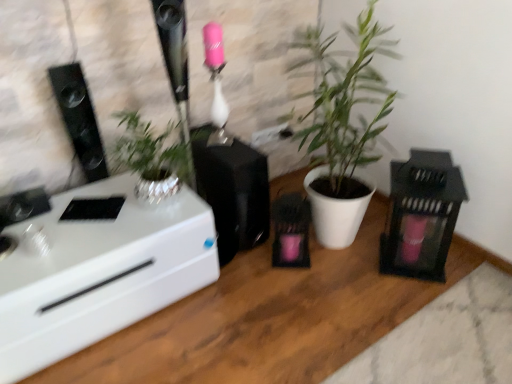
Question: Is black matte speaker at center, which is counted as the first appliance, starting from the left, placed right next to white glossy desk at left?

Choices:
 (A) no
 (B) yes

Answer: (A)

Question: Is black matte speaker at center, which is counted as the first appliance, starting from the left, not within white glossy desk at left?

Choices:
 (A) no
 (B) yes

Answer: (B)

Question: Is black matte speaker at center, arranged as the second appliance when viewed from the right, further to camera compared to white glossy desk at left?

Choices:
 (A) no
 (B) yes

Answer: (B)

Question: Is black matte speaker at center, arranged as the second appliance when viewed from the right, positioned in front of white glossy desk at left?

Choices:
 (A) yes
 (B) no

Answer: (B)

Question: Considering the relative sizes of black matte speaker at center, which is counted as the first appliance, starting from the left, and white glossy desk at left in the image provided, is black matte speaker at center, which is counted as the first appliance, starting from the left, smaller than white glossy desk at left?

Choices:
 (A) no
 (B) yes

Answer: (B)

Question: Does black matte speaker at center, arranged as the second appliance when viewed from the right, turn towards white glossy desk at left?

Choices:
 (A) no
 (B) yes

Answer: (A)

Question: From the image's perspective, would you say black glossy speaker at left is shown under black matte lantern at right, which is the 2th appliance from left to right?

Choices:
 (A) no
 (B) yes

Answer: (A)

Question: Is black glossy speaker at left positioned in front of black matte lantern at right, which is the 2th appliance from left to right?

Choices:
 (A) no
 (B) yes

Answer: (B)

Question: Is black glossy speaker at left positioned beyond the bounds of black matte lantern at right, arranged as the first appliance when viewed from the right?

Choices:
 (A) no
 (B) yes

Answer: (B)

Question: From a real-world perspective, is black glossy speaker at left physically below black matte lantern at right, which is the 2th appliance from left to right?

Choices:
 (A) yes
 (B) no

Answer: (B)

Question: From the image's perspective, is black glossy speaker at left above black matte lantern at right, arranged as the first appliance when viewed from the right?

Choices:
 (A) no
 (B) yes

Answer: (B)

Question: Would you consider black glossy speaker at left to be distant from black matte lantern at right, arranged as the first appliance when viewed from the right?

Choices:
 (A) yes
 (B) no

Answer: (A)

Question: Considering the relative positions of black matte lantern at right, arranged as the first appliance when viewed from the right, and black matte speaker at center, which is counted as the first appliance, starting from the left, in the image provided, is black matte lantern at right, arranged as the first appliance when viewed from the right, behind black matte speaker at center, which is counted as the first appliance, starting from the left,?

Choices:
 (A) yes
 (B) no

Answer: (B)